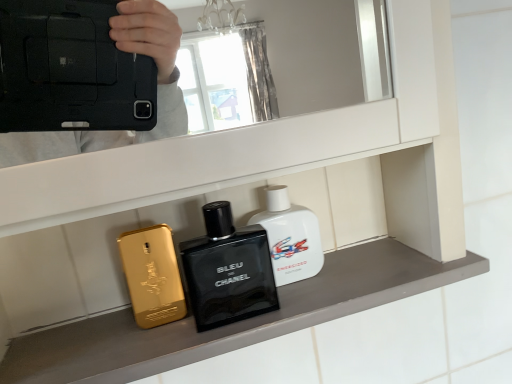
Identify the location of empty space that is to the right of gold metallic phone at left, the second perfume when ordered from right to left. The image size is (512, 384). (289, 287).